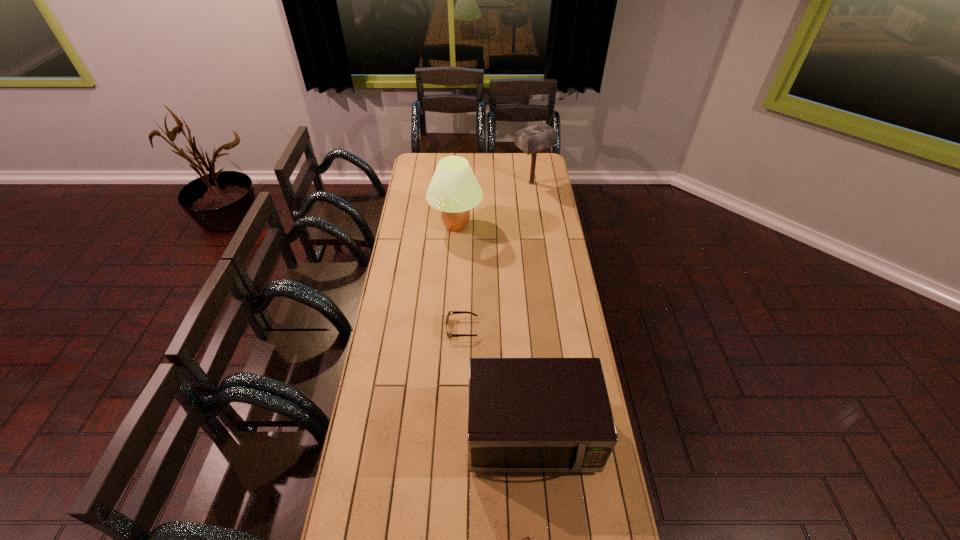
The width and height of the screenshot is (960, 540). What are the coordinates of `mallet` in the screenshot? It's located at (532, 139).

At what (x,y) coordinates should I click in order to perform the action: click on the fourth nearest object. Please return your answer as a coordinate pair (x, y). The width and height of the screenshot is (960, 540). Looking at the image, I should click on (454, 190).

Where is `the fourth farthest object`? This screenshot has height=540, width=960. the fourth farthest object is located at coordinates (524, 414).

Locate an element on the screen. This screenshot has width=960, height=540. microwave oven is located at coordinates (524, 414).

At what (x,y) coordinates should I click in order to perform the action: click on sunglasses. Please return your answer as a coordinate pair (x, y). The height and width of the screenshot is (540, 960). Looking at the image, I should click on (454, 312).

Identify the location of the second shortest object. (x=454, y=312).

Locate an element on the screen. free space located on the left of the mallet is located at coordinates (460, 183).

Where is `free region located 0.080m on the shade of the lampshade`? The width and height of the screenshot is (960, 540). free region located 0.080m on the shade of the lampshade is located at coordinates (498, 226).

Locate an element on the screen. The width and height of the screenshot is (960, 540). vacant space located on the front-facing side of the third shortest object is located at coordinates (540, 536).

Find the location of a particular element. vacant space located 0.220m on the front-facing side of the second shortest object is located at coordinates (530, 328).